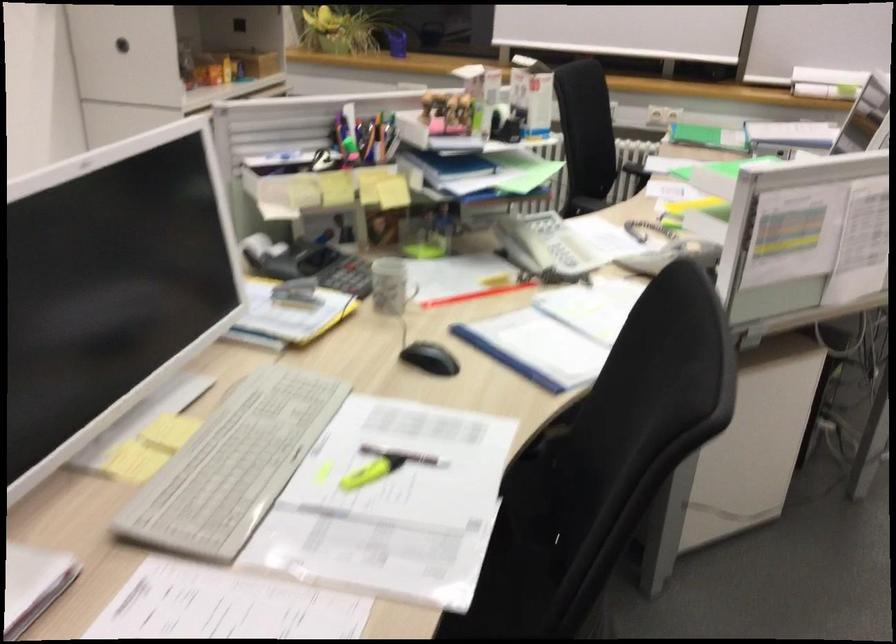
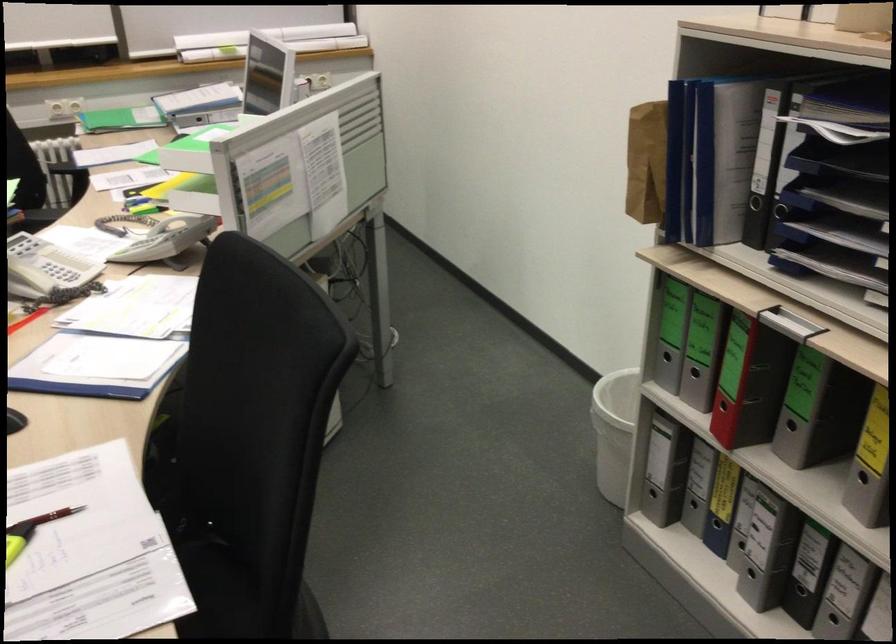
Locate, in the second image, the point that corresponds to point 685,239 in the first image.

(179, 223)